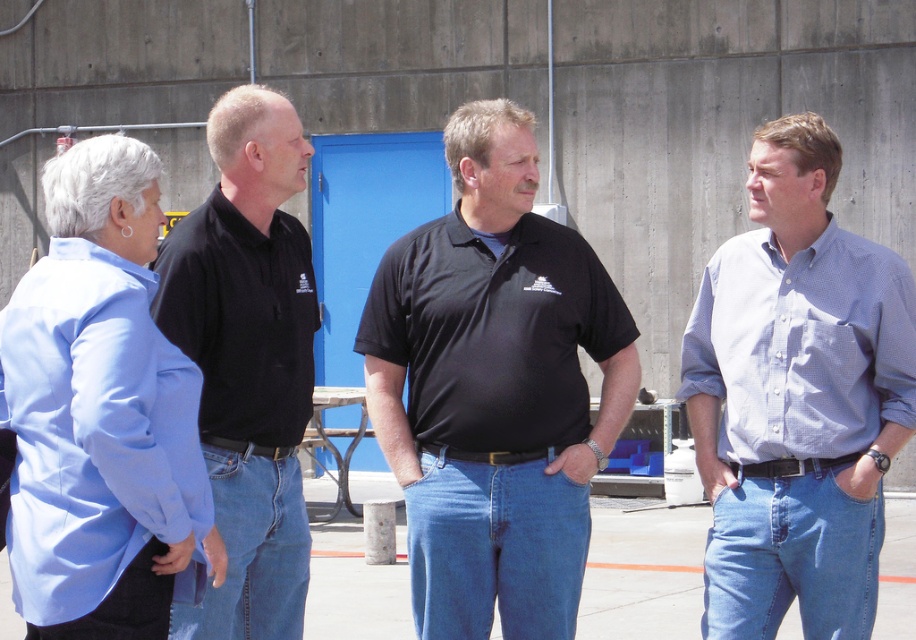
Question: Which point is closer to the camera?

Choices:
 (A) black matte polo shirt at center
 (B) light blue textured shirt at right
 (C) black matte shirt at left

Answer: (C)

Question: Can you confirm if black matte shirt at left is positioned below denim jeans at lower left?

Choices:
 (A) yes
 (B) no

Answer: (B)

Question: Estimate the real-world distances between objects in this image. Which object is closer to the matte black polo shirt at left?

Choices:
 (A) light blue textured shirt at right
 (B) denim jeans at lower left

Answer: (B)

Question: Among these objects, which one is farthest from the camera?

Choices:
 (A) light blue textured shirt at right
 (B) blue checkered shirt at right
 (C) denim jeans at right
 (D) denim jeans at center

Answer: (D)

Question: Is black cotton polo shirt at center to the left of black matte shirt at left from the viewer's perspective?

Choices:
 (A) yes
 (B) no

Answer: (B)

Question: Is blue checkered shirt at right wider than matte black polo shirt at left?

Choices:
 (A) yes
 (B) no

Answer: (A)